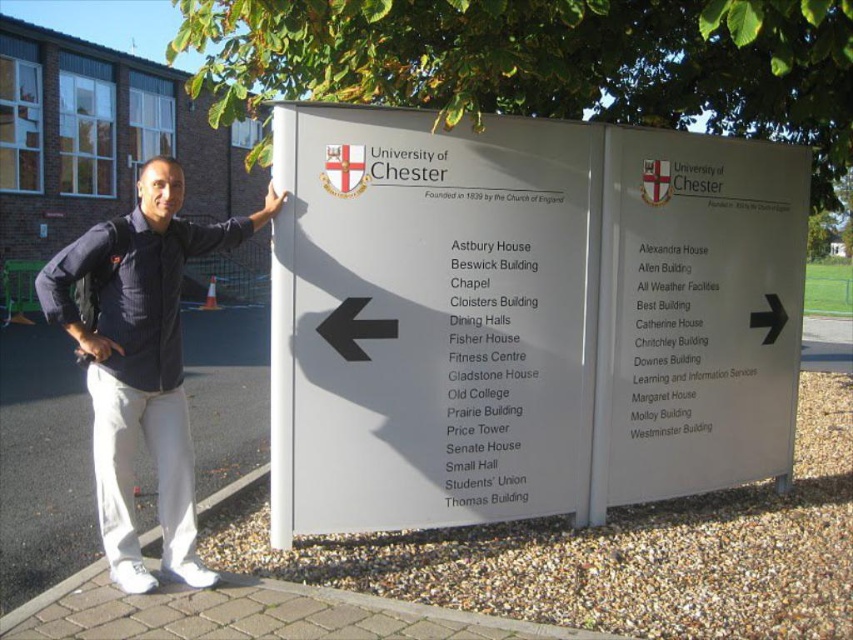
You are a visitor at the University of Chester and see the white plastic sign at center and the dark blue shirt at upper left in the image. Which object is positioned higher from the ground?

The white plastic sign at center is located above the dark blue shirt at upper left, so it is positioned higher from the ground.

Based on the photo, you are standing in front of the University of Chester directional sign. You see a point marked at coordinates (524, 317). What object is located at that point?

The point marked at coordinates (524, 317) is the white plastic sign at center.

The man is standing next to the white matte sign at right. If he wants to reach the nearest building listed on the left section of the sign, which direction should he walk?

The man should walk to the left because the left section of the sign lists buildings in that direction, as indicated by the arrows pointing to the left.